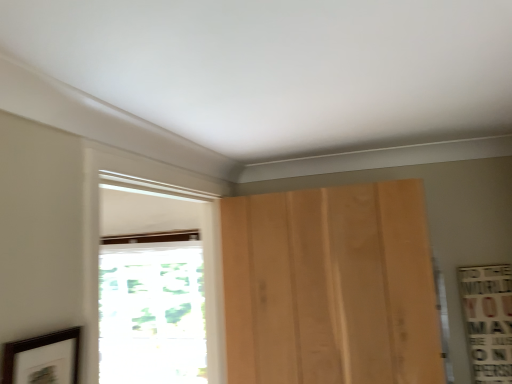
Question: Is light brown wood door at center not close to white wood window at center, the first window from the front?

Choices:
 (A) no
 (B) yes

Answer: (A)

Question: Is light brown wood door at center oriented away from white wood window at center, the first window from the front?

Choices:
 (A) no
 (B) yes

Answer: (A)

Question: Is light brown wood door at center at the left side of white wood window at center, the first window from the front?

Choices:
 (A) no
 (B) yes

Answer: (A)

Question: Can you confirm if light brown wood door at center is wider than white wood window at center, the first window from the front?

Choices:
 (A) no
 (B) yes

Answer: (A)

Question: Is light brown wood door at center smaller than white wood window at center, placed as the 2th window when sorted from back to front?

Choices:
 (A) yes
 (B) no

Answer: (A)

Question: Based on their positions, is transparent glass window at left, which is counted as the 1th window, starting from the back, located to the left or right of dark brown wooden picture frame at lower left?

Choices:
 (A) left
 (B) right

Answer: (A)

Question: From the image's perspective, is transparent glass window at left, which appears as the second window when viewed from the front, above or below dark brown wooden picture frame at lower left?

Choices:
 (A) below
 (B) above

Answer: (A)

Question: In the image, is transparent glass window at left, which appears as the second window when viewed from the front, positioned in front of or behind dark brown wooden picture frame at lower left?

Choices:
 (A) front
 (B) behind

Answer: (B)

Question: From a real-world perspective, is transparent glass window at left, which is counted as the 1th window, starting from the back, above or below dark brown wooden picture frame at lower left?

Choices:
 (A) above
 (B) below

Answer: (B)

Question: Is dark brown wooden picture frame at lower left taller or shorter than transparent glass window at left, which appears as the second window when viewed from the front?

Choices:
 (A) tall
 (B) short

Answer: (B)

Question: In terms of size, does dark brown wooden picture frame at lower left appear bigger or smaller than transparent glass window at left, which is counted as the 1th window, starting from the back?

Choices:
 (A) small
 (B) big

Answer: (A)

Question: From the image's perspective, is dark brown wooden picture frame at lower left positioned above or below transparent glass window at left, which appears as the second window when viewed from the front?

Choices:
 (A) above
 (B) below

Answer: (A)

Question: Based on their positions, is dark brown wooden picture frame at lower left located to the left or right of transparent glass window at left, which appears as the second window when viewed from the front?

Choices:
 (A) left
 (B) right

Answer: (B)

Question: In terms of size, does white wood window at center, the first window from the front, appear bigger or smaller than dark brown wooden picture frame at lower left?

Choices:
 (A) small
 (B) big

Answer: (B)

Question: From the image's perspective, is white wood window at center, placed as the 2th window when sorted from back to front, above or below dark brown wooden picture frame at lower left?

Choices:
 (A) above
 (B) below

Answer: (A)